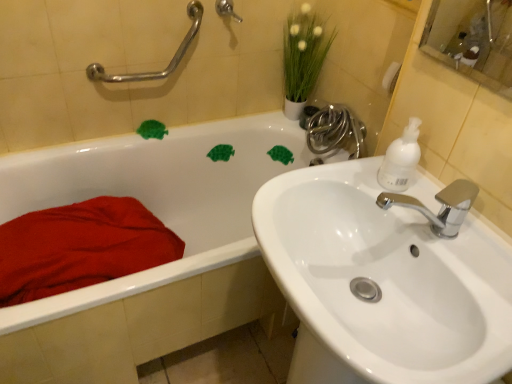
Question: Is white matte soap dispenser at upper right oriented towards white glossy sink at right?

Choices:
 (A) no
 (B) yes

Answer: (A)

Question: From a real-world perspective, is white matte soap dispenser at upper right below white glossy sink at right?

Choices:
 (A) no
 (B) yes

Answer: (A)

Question: Is white matte soap dispenser at upper right turned away from white glossy sink at right?

Choices:
 (A) yes
 (B) no

Answer: (B)

Question: Can you confirm if white matte soap dispenser at upper right is shorter than white glossy sink at right?

Choices:
 (A) yes
 (B) no

Answer: (A)

Question: Can we say white matte soap dispenser at upper right lies outside white glossy sink at right?

Choices:
 (A) no
 (B) yes

Answer: (B)

Question: Considering their positions, is white glossy sink at right located in front of or behind shiny chrome faucet at upper right?

Choices:
 (A) front
 (B) behind

Answer: (A)

Question: Considering the positions of white glossy sink at right and shiny chrome faucet at upper right in the image, is white glossy sink at right wider or thinner than shiny chrome faucet at upper right?

Choices:
 (A) wide
 (B) thin

Answer: (A)

Question: Is white glossy sink at right spatially inside shiny chrome faucet at upper right, or outside of it?

Choices:
 (A) outside
 (B) inside

Answer: (A)

Question: From the image's perspective, relative to shiny chrome faucet at upper right, is white glossy sink at right above or below?

Choices:
 (A) above
 (B) below

Answer: (B)

Question: From the image's perspective, is white matte soap dispenser at upper right located above or below green matte plant at upper center?

Choices:
 (A) above
 (B) below

Answer: (B)

Question: Is white matte soap dispenser at upper right wider or thinner than green matte plant at upper center?

Choices:
 (A) wide
 (B) thin

Answer: (B)

Question: In terms of size, does white matte soap dispenser at upper right appear bigger or smaller than green matte plant at upper center?

Choices:
 (A) small
 (B) big

Answer: (A)

Question: From a real-world perspective, relative to green matte plant at upper center, is white matte soap dispenser at upper right vertically above or below?

Choices:
 (A) below
 (B) above

Answer: (B)

Question: From a real-world perspective, is shiny chrome faucet at upper right above or below white matte soap dispenser at upper right?

Choices:
 (A) above
 (B) below

Answer: (B)

Question: Looking at their shapes, would you say shiny chrome faucet at upper right is wider or thinner than white matte soap dispenser at upper right?

Choices:
 (A) thin
 (B) wide

Answer: (B)